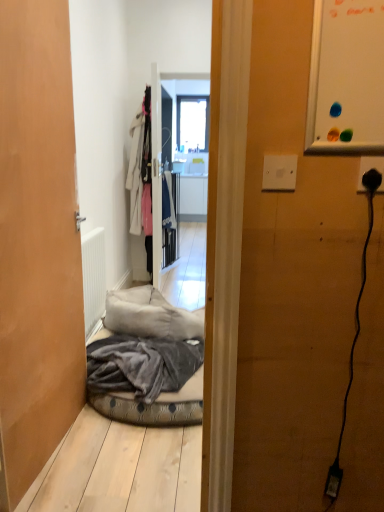
Find the location of a particular element. The image size is (384, 512). vacant region to the right of wooden door at left is located at coordinates (123, 456).